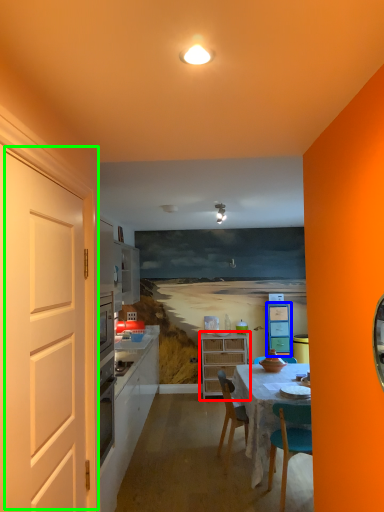
Question: Which object is the farthest from cabinetry (highlighted by a red box)? Choose among these: cabinetry (highlighted by a blue box) or door (highlighted by a green box).

Choices:
 (A) cabinetry
 (B) door

Answer: (B)